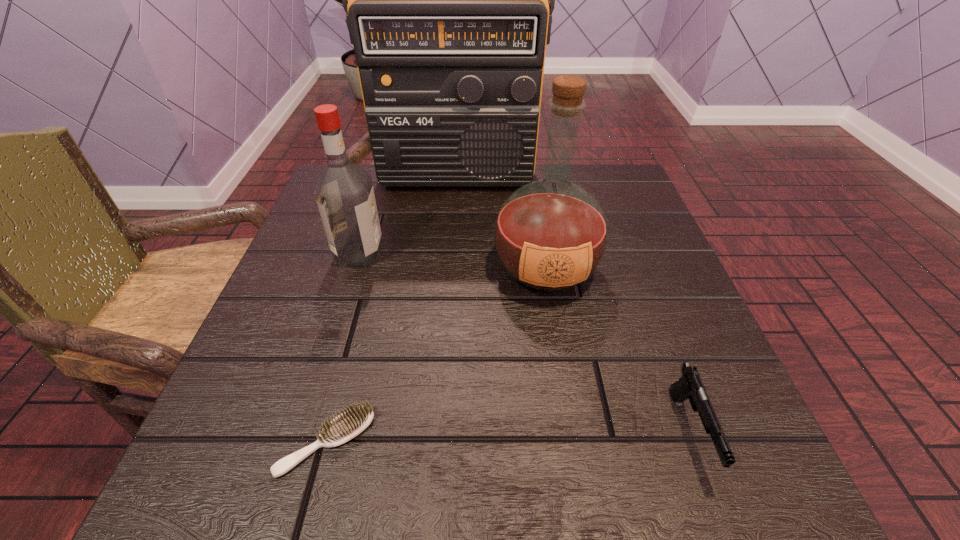
Find the location of a particular element. object that stands as the fourth closest to the third tallest object is located at coordinates (690, 386).

Where is `vacant space that satisfies the following two spatial constraints: 1. on the front-facing side of the third tallest object; 2. on the back side of the shortest object`? This screenshot has height=540, width=960. vacant space that satisfies the following two spatial constraints: 1. on the front-facing side of the third tallest object; 2. on the back side of the shortest object is located at coordinates (300, 442).

Where is `free space in the image that satisfies the following two spatial constraints: 1. on the front-facing side of the radio receiver; 2. on the front-facing side of the third shortest object`? free space in the image that satisfies the following two spatial constraints: 1. on the front-facing side of the radio receiver; 2. on the front-facing side of the third shortest object is located at coordinates [x=450, y=253].

At what (x,y) coordinates should I click in order to perform the action: click on blank area in the image that satisfies the following two spatial constraints: 1. on the front-facing side of the radio receiver; 2. on the front-facing side of the third shortest object. Please return your answer as a coordinate pair (x, y). The width and height of the screenshot is (960, 540). Looking at the image, I should click on (450, 253).